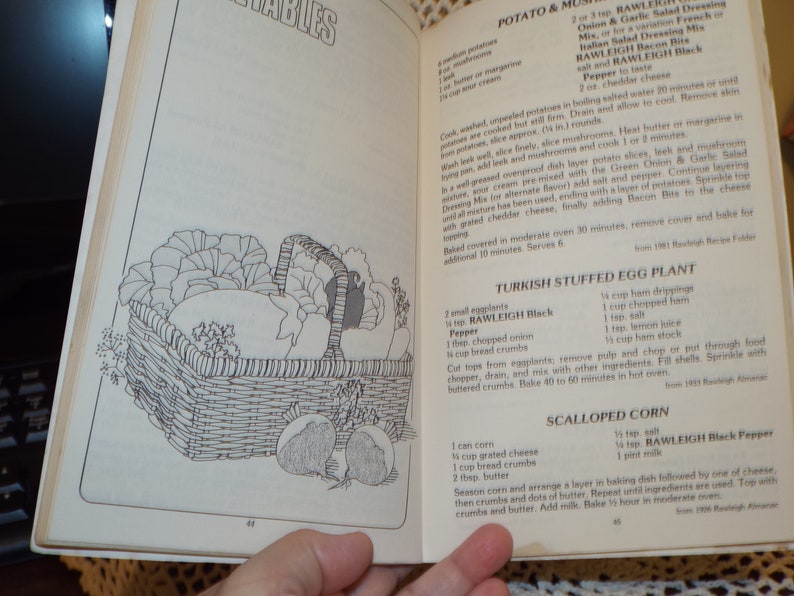
This screenshot has height=596, width=794. What are the coordinates of `keybaord` in the screenshot? It's located at (29, 445).